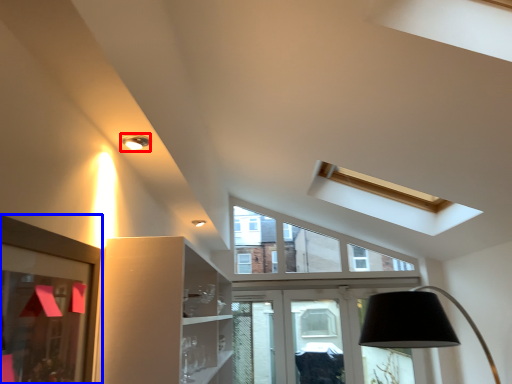
Question: Among these objects, which one is farthest to the camera, light fixture (highlighted by a red box) or picture frame (highlighted by a blue box)?

Choices:
 (A) light fixture
 (B) picture frame

Answer: (A)